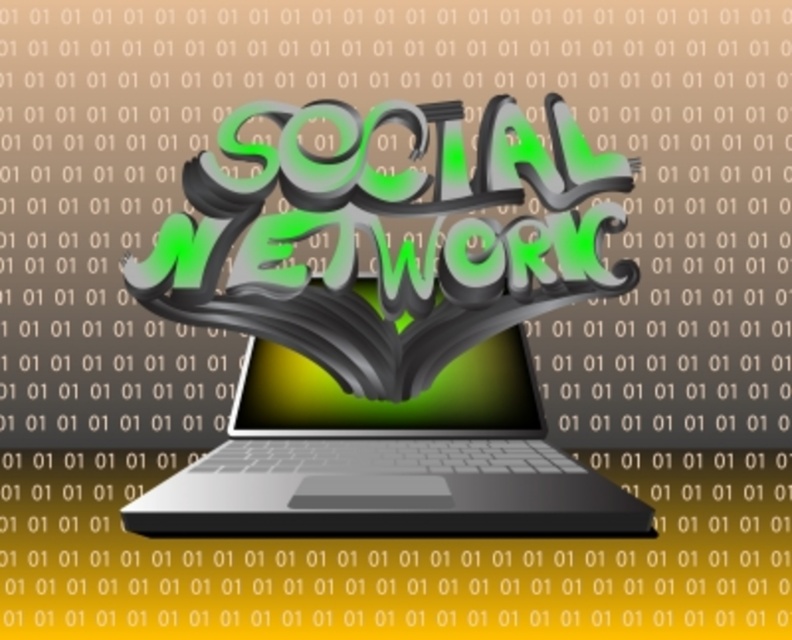
Does point (303, 449) come farther from viewer compared to point (250, 372)?

No, it is in front of (250, 372).

Is point (177, 490) positioned behind point (473, 428)?

No, it is not.

Find the location of a particular element. The width and height of the screenshot is (792, 640). satin black laptop at center is located at coordinates (387, 458).